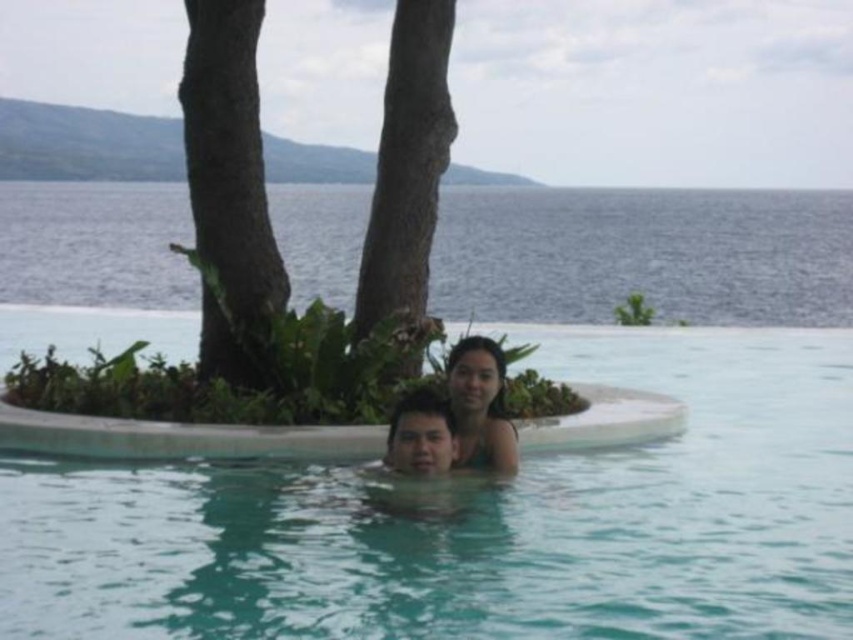
Which of these two, clear blue water at center or smooth skin man at center, stands shorter?

Standing shorter between the two is smooth skin man at center.

Can you confirm if clear blue water at center is positioned above smooth skin man at center?

Yes, clear blue water at center is above smooth skin man at center.

Who is more distant from viewer, (577, 600) or (392, 445)?

Point (392, 445)

You are a GUI agent. You are given a task and a screenshot of the screen. Output one action in this format:
    pyautogui.click(x=<x>, y=<y>)
    Task: Click on the clear blue water at center
    
    Given the screenshot: What is the action you would take?
    (479, 520)

Does point (384, 307) come closer to viewer compared to point (409, 401)?

No, (384, 307) is behind (409, 401).

Between brown rough tree trunk at upper center and smooth skin man at center, which one is positioned lower?

smooth skin man at center is below.

The image size is (853, 640). Describe the element at coordinates (407, 164) in the screenshot. I see `brown rough tree trunk at upper center` at that location.

Where is `brown rough tree trunk at upper center`? This screenshot has width=853, height=640. brown rough tree trunk at upper center is located at coordinates (407, 164).

Does brown rough tree trunk at upper left have a greater width compared to smooth skin woman at center?

Yes, brown rough tree trunk at upper left is wider than smooth skin woman at center.

This screenshot has height=640, width=853. What do you see at coordinates (229, 189) in the screenshot? I see `brown rough tree trunk at upper left` at bounding box center [229, 189].

Does point (256, 241) come in front of point (505, 420)?

No, it is behind (505, 420).

I want to click on brown rough tree trunk at upper left, so click(x=229, y=189).